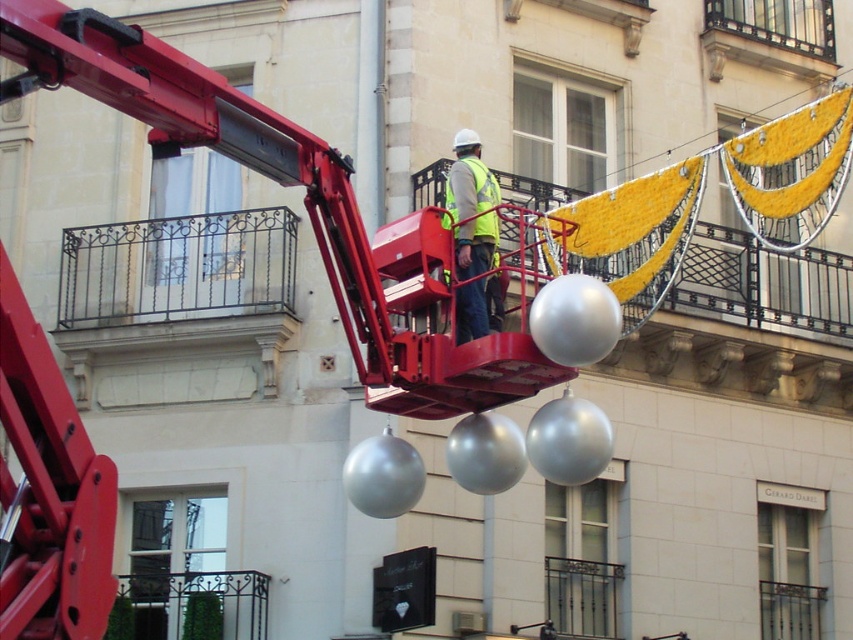
Who is higher up, reflective silver vest at center or yellow reflective safety vest at center?

reflective silver vest at center is higher up.

Is reflective silver vest at center closer to camera compared to yellow reflective safety vest at center?

No, reflective silver vest at center is behind yellow reflective safety vest at center.

Is point (457, 339) closer to camera compared to point (485, 198)?

Yes, it is in front of point (485, 198).

Locate an element on the screen. This screenshot has height=640, width=853. reflective silver vest at center is located at coordinates (473, 205).

Between wrought iron balcony at upper left and yellow reflective safety vest at center, which one has less height?

Standing shorter between the two is wrought iron balcony at upper left.

Looking at this image, who is positioned more to the right, wrought iron balcony at upper left or yellow reflective safety vest at center?

From the viewer's perspective, yellow reflective safety vest at center appears more on the right side.

This screenshot has height=640, width=853. What do you see at coordinates (175, 273) in the screenshot?
I see `wrought iron balcony at upper left` at bounding box center [175, 273].

This screenshot has width=853, height=640. Find the location of `wrought iron balcony at upper left`. wrought iron balcony at upper left is located at coordinates (175, 273).

Who is positioned more to the left, wrought iron balcony at upper left or reflective silver vest at center?

From the viewer's perspective, wrought iron balcony at upper left appears more on the left side.

Find the location of a particular element. The width and height of the screenshot is (853, 640). wrought iron balcony at upper left is located at coordinates (175, 273).

Which is in front, point (260, 314) or point (476, 280)?

Point (476, 280)

I want to click on wrought iron balcony at upper left, so click(x=175, y=273).